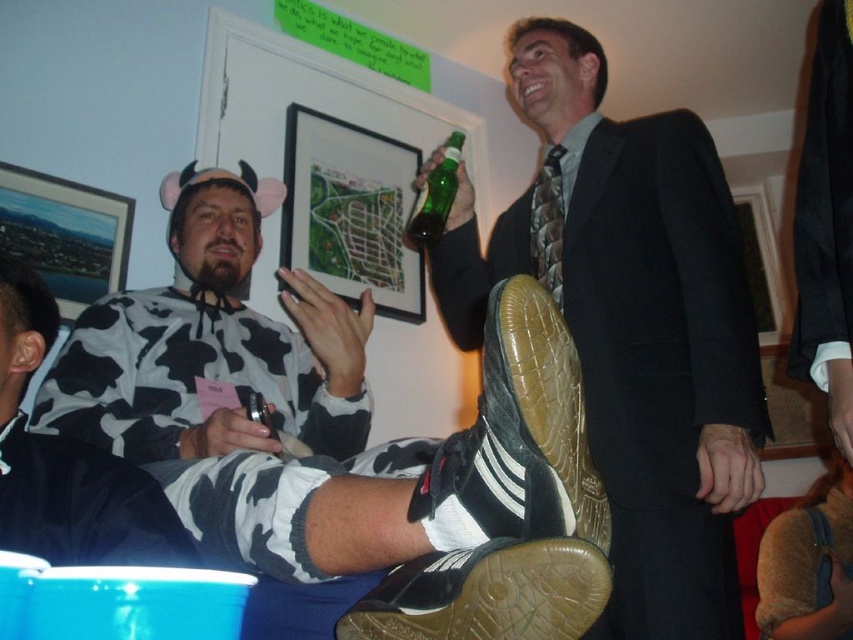
You are a photographer at the party and want to take a picture of the cow print sweater at center and the green glass bottle at upper center. Which object should you focus on first to ensure both are in focus?

The cow print sweater at center is closer to the viewer than the green glass bottle at upper center, so you should focus on the cow print sweater at center first to ensure both are in focus.

You are a photographer at a party and want to take a picture of the shiny black suit at upper right and the leather braided tie at upper center. Which object should you zoom in more on to ensure it appears larger in the photo?

You should zoom in more on the leather braided tie at upper center because the shiny black suit at upper right is bigger in reality, so zooming in on the smaller object will make it appear larger in the photo.